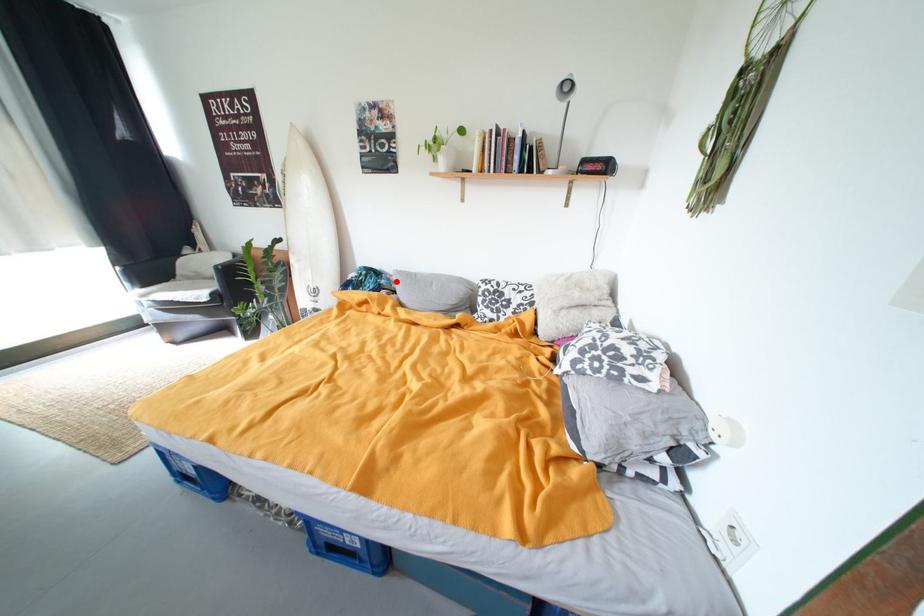
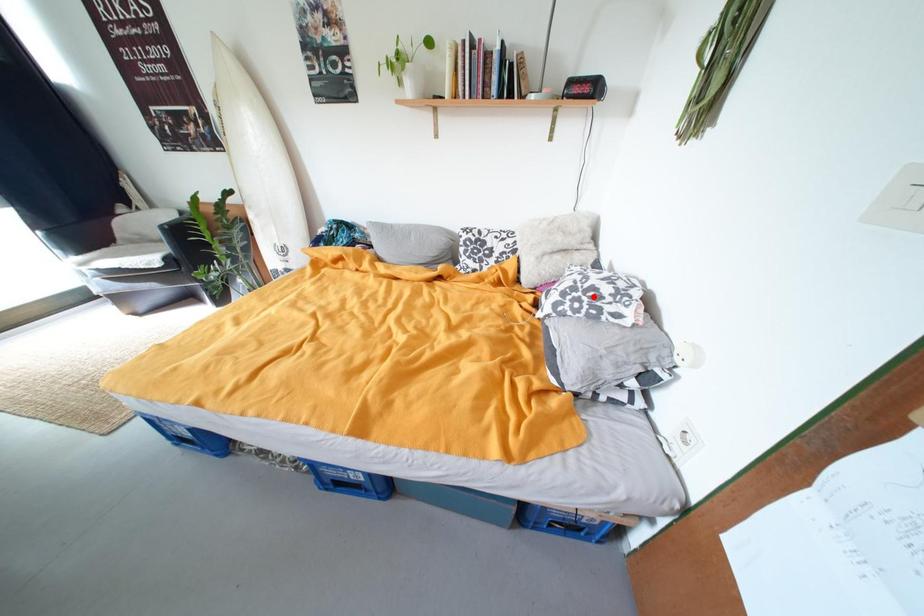
I am providing you with two images of the same scene from different viewpoints. A red point is marked on the first image and another point is marked on the second image. Is the red point in image1 aligned with the point shown in image2?

No